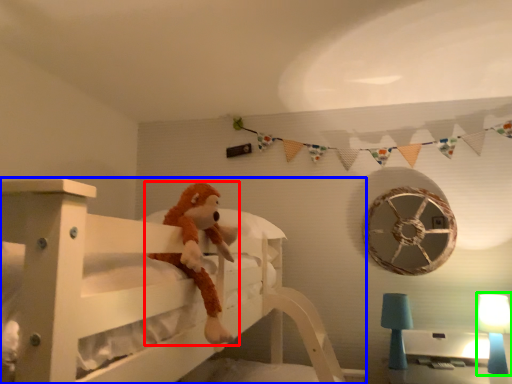
Question: Based on their relative distances, which object is farther from toy (highlighted by a red box)? Choose from furniture (highlighted by a blue box) and table lamp (highlighted by a green box).

Choices:
 (A) furniture
 (B) table lamp

Answer: (B)